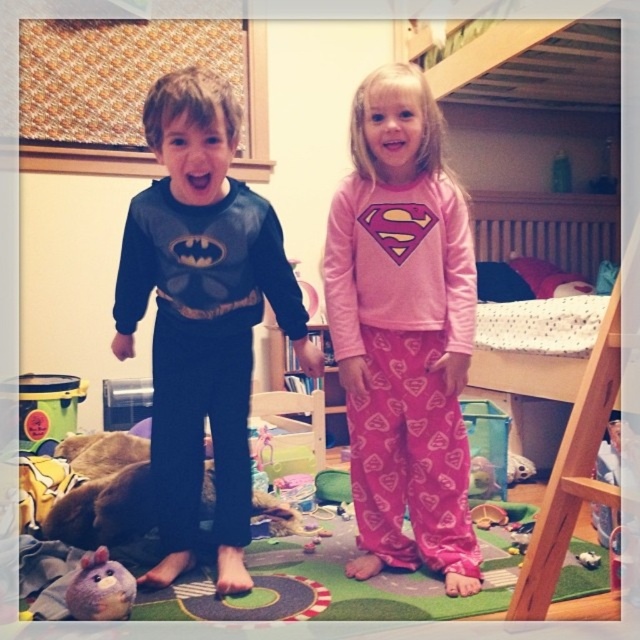
Can you confirm if pink heart-patterned pajamas at center is wider than brown fur dog at lower left?

In fact, pink heart-patterned pajamas at center might be narrower than brown fur dog at lower left.

The width and height of the screenshot is (640, 640). In order to click on pink heart-patterned pajamas at center in this screenshot , I will do `click(403, 332)`.

Can you confirm if pink heart-patterned pajamas at center is positioned to the left of matte black sweatshirt at center?

Incorrect, pink heart-patterned pajamas at center is not on the left side of matte black sweatshirt at center.

Is pink heart-patterned pajamas at center closer to the viewer compared to matte black sweatshirt at center?

No, it is behind matte black sweatshirt at center.

Is point (458, 324) positioned behind point (180, 236)?

Yes, point (458, 324) is behind point (180, 236).

You are a GUI agent. You are given a task and a screenshot of the screen. Output one action in this format:
    pyautogui.click(x=<x>, y=<y>)
    Task: Click on the pink heart-patterned pajamas at center
    This screenshot has height=640, width=640.
    Given the screenshot: What is the action you would take?
    pyautogui.click(x=403, y=332)

Is matte black sweatshirt at center closer to the viewer compared to brown fur dog at lower left?

That is True.

Is matte black sweatshirt at center taller than brown fur dog at lower left?

Yes, matte black sweatshirt at center is taller than brown fur dog at lower left.

Does point (170, 465) lie in front of point (113, 497)?

That is True.

I want to click on matte black sweatshirt at center, so click(202, 314).